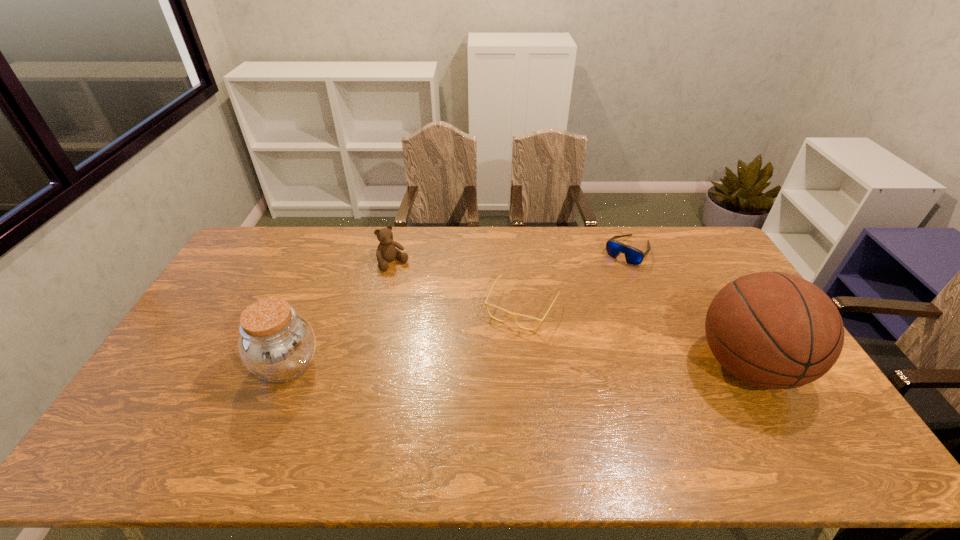
Locate an element on the screen. This screenshot has height=540, width=960. free location located on the front-facing side of the fourth object from right to left is located at coordinates (450, 328).

Where is `vacant area situated 0.280m on the front-facing side of the fourth object from right to left`? This screenshot has height=540, width=960. vacant area situated 0.280m on the front-facing side of the fourth object from right to left is located at coordinates (442, 318).

Where is `vacant space situated on the front-facing side of the sunglasses`? Image resolution: width=960 pixels, height=540 pixels. vacant space situated on the front-facing side of the sunglasses is located at coordinates (566, 328).

In order to click on free spot located on the front-facing side of the sunglasses in this screenshot , I will do `click(602, 285)`.

The height and width of the screenshot is (540, 960). I want to click on free location located on the front-facing side of the sunglasses, so click(608, 277).

The width and height of the screenshot is (960, 540). Identify the location of free space located 0.080m in front of the lenses of the shortest object. (498, 349).

This screenshot has height=540, width=960. What are the coordinates of `blank space located in front of the lenses of the shortest object` in the screenshot? It's located at (500, 347).

This screenshot has height=540, width=960. In order to click on free space located in front of the lenses of the shortest object in this screenshot , I will do `click(485, 375)`.

You are a GUI agent. You are given a task and a screenshot of the screen. Output one action in this format:
    pyautogui.click(x=<x>, y=<y>)
    Task: Click on the teddy bear at the far edge
    This screenshot has width=960, height=540.
    Given the screenshot: What is the action you would take?
    pyautogui.click(x=386, y=251)

The image size is (960, 540). Identify the location of sunglasses at the far edge. (633, 256).